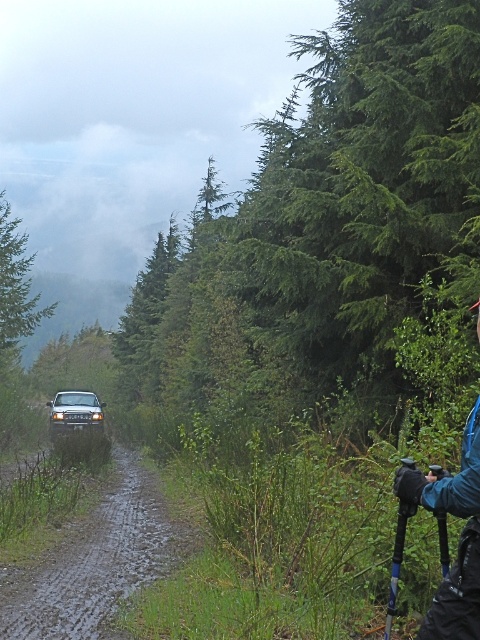
Question: Which of the following is the closest to the observer?

Choices:
 (A) (90, 429)
 (B) (432, 502)
 (C) (44, 573)

Answer: (B)

Question: Which is farther from the blue fabric camera at lower right?

Choices:
 (A) shiny silver suv at center
 (B) muddy dirt road at left

Answer: (A)

Question: Which point appears farthest from the camera in this image?

Choices:
 (A) (132, 499)
 (B) (56, 420)
 (C) (462, 589)

Answer: (B)

Question: Is muddy dirt road at left to the right of blue fabric camera at lower right from the viewer's perspective?

Choices:
 (A) no
 (B) yes

Answer: (A)

Question: Is muddy dirt road at left to the right of shiny silver suv at center from the viewer's perspective?

Choices:
 (A) no
 (B) yes

Answer: (B)

Question: Is blue fabric camera at lower right behind shiny silver suv at center?

Choices:
 (A) yes
 (B) no

Answer: (B)